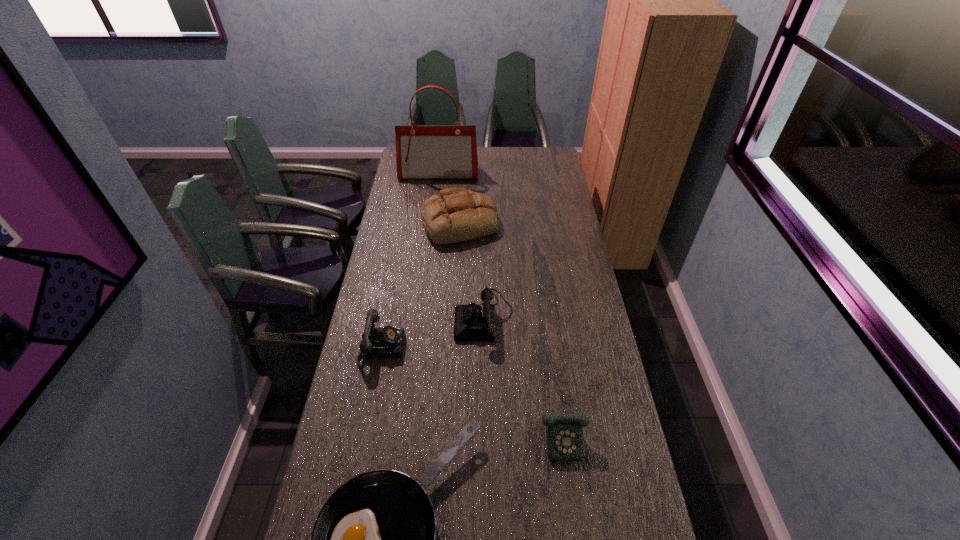
Where is `object that can be found as the fourth closest to the tallest object`? The width and height of the screenshot is (960, 540). object that can be found as the fourth closest to the tallest object is located at coordinates (564, 432).

What are the coordinates of `object that stands as the third closest to the leftmost telephone` in the screenshot? It's located at (454, 215).

Locate an element on the screen. The image size is (960, 540). the second closest telephone to the farthest object is located at coordinates (382, 342).

Choose which telephone is the nearest neighbor to the frying pan. Please provide its 2D coordinates. Your answer should be formatted as a tuple, i.e. [(x, y)], where the tuple contains the x and y coordinates of a point satisfying the conditions above.

[(564, 432)]

Find the location of a particular element. This screenshot has height=540, width=960. free space that satisfies the following two spatial constraints: 1. on the front side of the farthest object; 2. on the left side of the second tallest object is located at coordinates (433, 223).